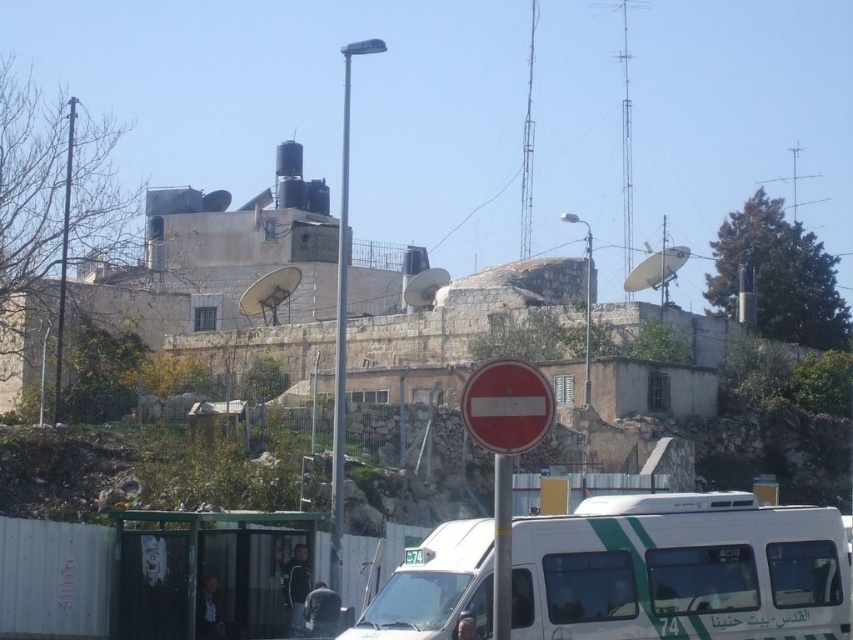
Looking at this image, measure the distance between white glossy van at center and green plastic bus at center.

white glossy van at center and green plastic bus at center are 5.89 meters apart.

Find the location of `white glossy van at center`. white glossy van at center is located at coordinates (680, 570).

The height and width of the screenshot is (640, 853). Identify the location of white glossy van at center. (680, 570).

Is red matte sign at center smaller than green plastic bus at center?

Actually, red matte sign at center might be larger than green plastic bus at center.

Does red matte sign at center appear under green plastic bus at center?

Actually, red matte sign at center is above green plastic bus at center.

Image resolution: width=853 pixels, height=640 pixels. What do you see at coordinates (508, 406) in the screenshot?
I see `red matte sign at center` at bounding box center [508, 406].

Find the location of a particular element. Image resolution: width=853 pixels, height=640 pixels. red matte sign at center is located at coordinates (508, 406).

Is point (723, 634) positioned after point (503, 444)?

Yes, point (723, 634) is behind point (503, 444).

Which of these two, white glossy van at center or red matte sign at center, stands taller?

With more height is white glossy van at center.

Describe the element at coordinates (680, 570) in the screenshot. I see `white glossy van at center` at that location.

Identify the location of white glossy van at center. The width and height of the screenshot is (853, 640). (680, 570).